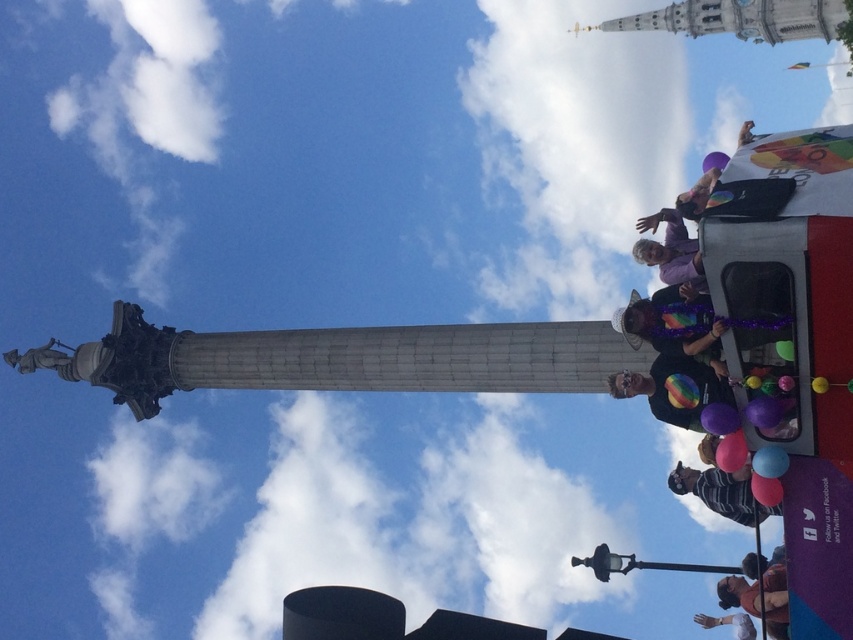
Can you confirm if purple matte shirt at upper right is taller than rubber balloon at lower right?

Yes, purple matte shirt at upper right is taller than rubber balloon at lower right.

Locate an element on the screen. The image size is (853, 640). purple matte shirt at upper right is located at coordinates (670, 250).

Between striped cotton shirt at lower right and matte blue balloon at lower right, which one is positioned higher?

matte blue balloon at lower right

Is striped cotton shirt at lower right to the left of matte blue balloon at lower right from the viewer's perspective?

Incorrect, striped cotton shirt at lower right is not on the left side of matte blue balloon at lower right.

Is point (669, 483) closer to camera compared to point (752, 461)?

No, (669, 483) is further to viewer.

Image resolution: width=853 pixels, height=640 pixels. Identify the location of striped cotton shirt at lower right. (722, 492).

Who is more forward, (x=657, y=250) or (x=784, y=451)?

Point (x=784, y=451)

The image size is (853, 640). In order to click on purple matte shirt at upper right in this screenshot , I will do `click(670, 250)`.